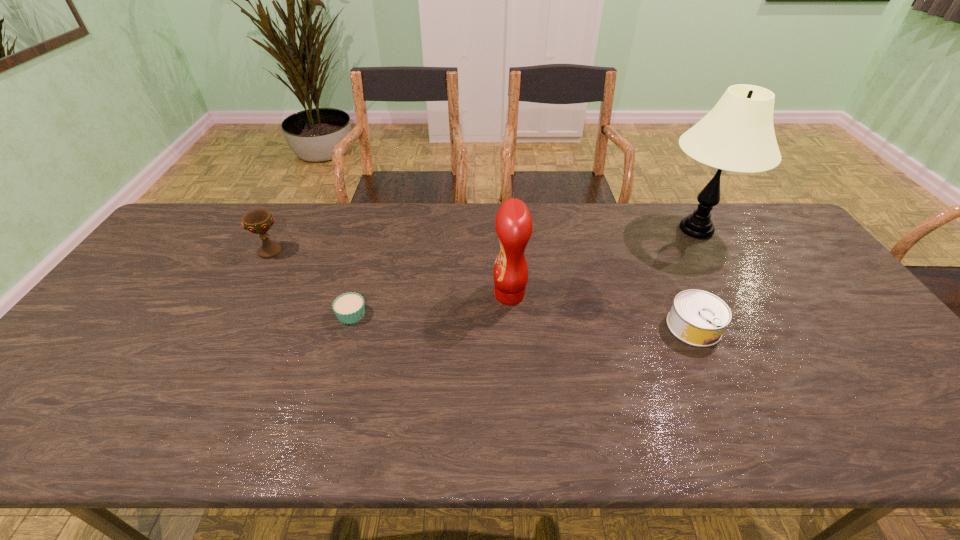
Where is `vacant point located on the label side of the condiment`? vacant point located on the label side of the condiment is located at coordinates (361, 295).

At what (x,y) coordinates should I click in order to perform the action: click on vacant space located 0.280m on the label side of the condiment. Please return your answer as a coordinate pair (x, y). Image resolution: width=960 pixels, height=540 pixels. Looking at the image, I should click on (394, 295).

Locate an element on the screen. The image size is (960, 540). free region located 0.230m on the back of the chalice is located at coordinates (297, 203).

This screenshot has width=960, height=540. I want to click on vacant space located 0.300m on the back of the second shortest object, so click(653, 239).

Locate an element on the screen. The width and height of the screenshot is (960, 540). free space located on the back of the shortest object is located at coordinates point(368,256).

This screenshot has width=960, height=540. What are the coordinates of `lamp located at the far edge` in the screenshot? It's located at (738, 135).

Where is `chalice that is positioned at the far edge`? chalice that is positioned at the far edge is located at coordinates (259, 221).

The width and height of the screenshot is (960, 540). Identify the location of free space at the far edge of the desktop. (678, 234).

In the image, there is a desktop. At what (x,y) coordinates should I click in order to perform the action: click on vacant space at the near edge. Please return your answer as a coordinate pair (x, y). The image size is (960, 540). Looking at the image, I should click on (542, 426).

Locate an element on the screen. free region at the right edge is located at coordinates (847, 298).